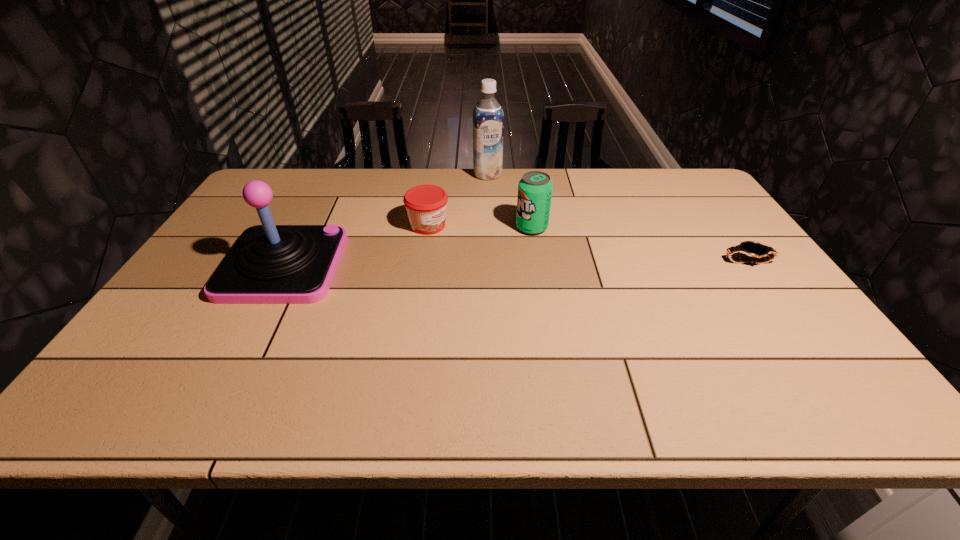
Find the location of a particular element. vacant space that satisfies the following two spatial constraints: 1. on the front side of the fourth tallest object; 2. on the left side of the rightmost object is located at coordinates (422, 262).

Where is `blank area in the image that satisfies the following two spatial constraints: 1. on the front side of the second object from left to right; 2. on the right side of the shortest object`? The height and width of the screenshot is (540, 960). blank area in the image that satisfies the following two spatial constraints: 1. on the front side of the second object from left to right; 2. on the right side of the shortest object is located at coordinates (422, 262).